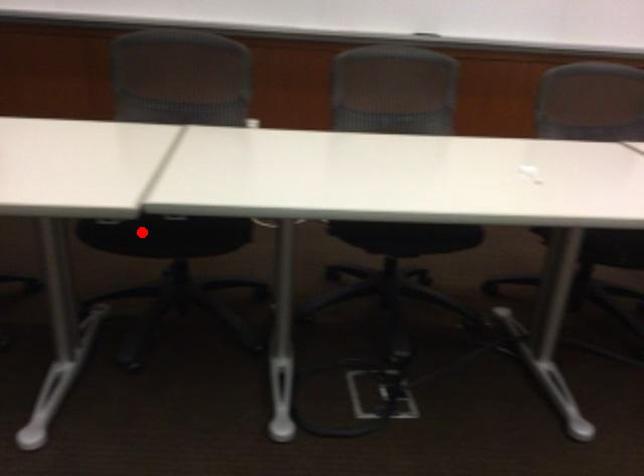
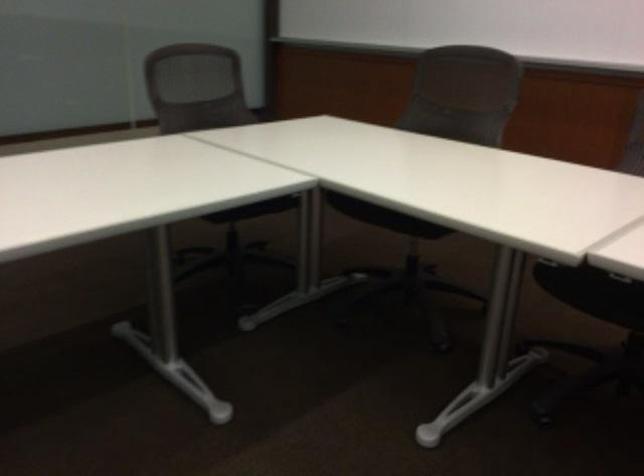
The point at the highlighted location is marked in the first image. Where is the corresponding point in the second image?

(592, 292)